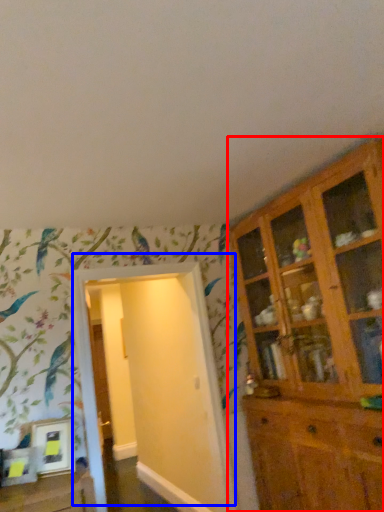
Question: Which of the following is the farthest to the observer, cupboard (highlighted by a red box) or door (highlighted by a blue box)?

Choices:
 (A) cupboard
 (B) door

Answer: (B)